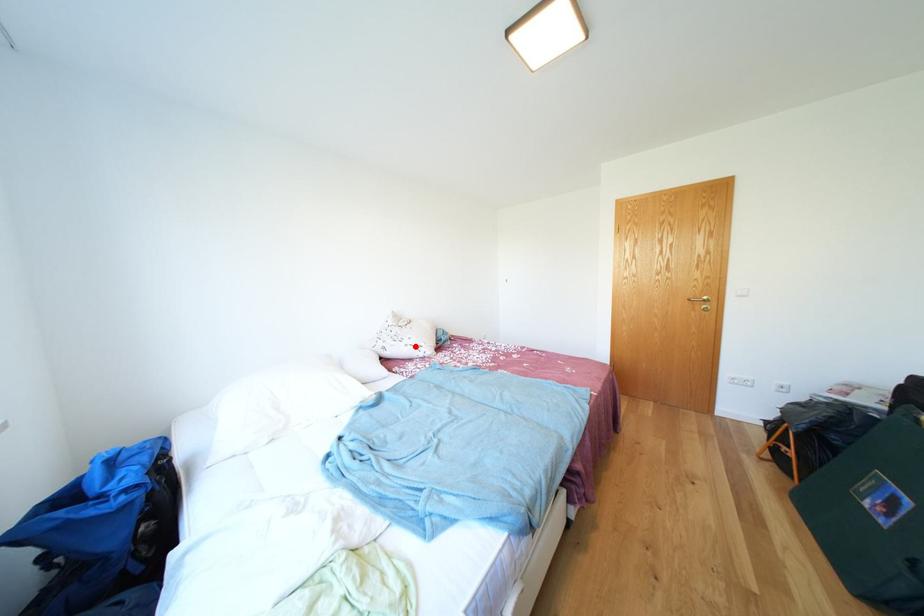
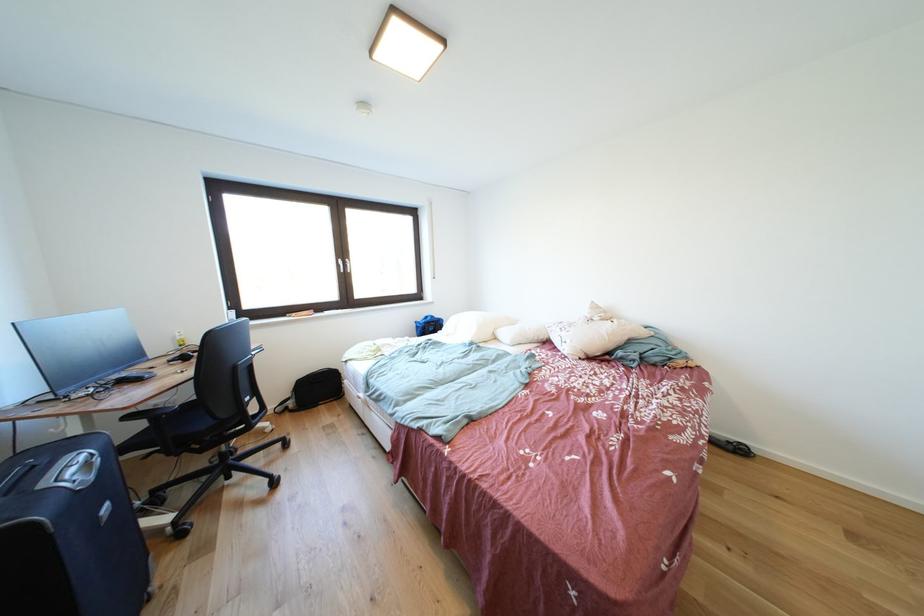
Locate, in the second image, the point that corresponds to the highlighted location in the first image.

(572, 338)